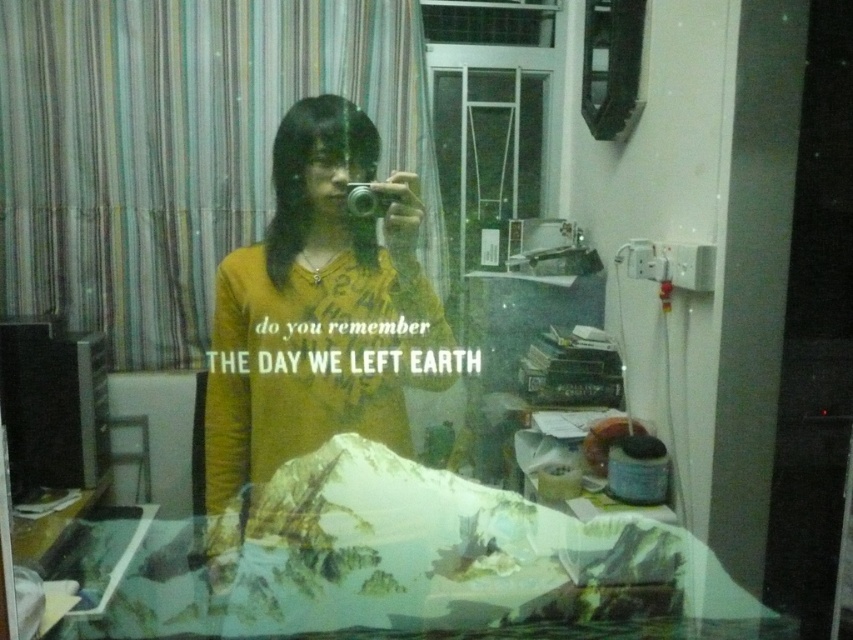
Who is lower down, yellow matte shirt at center or matte black camera at center?

yellow matte shirt at center is lower down.

Consider the image. Does yellow matte shirt at center have a lesser height compared to matte black camera at center?

No.

Between point (250, 481) and point (378, 189), which one is positioned behind?

The point (250, 481) is behind.

Locate an element on the screen. This screenshot has height=640, width=853. yellow matte shirt at center is located at coordinates (318, 308).